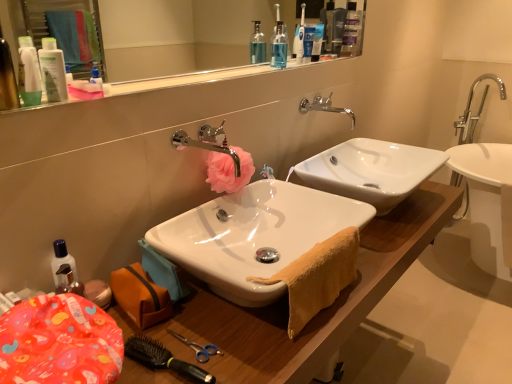
Locate an element on the screen. This screenshot has width=512, height=384. vacant area located to the right-hand side of black plastic brush at lower left, placed as the second brush when sorted from front to back is located at coordinates (254, 343).